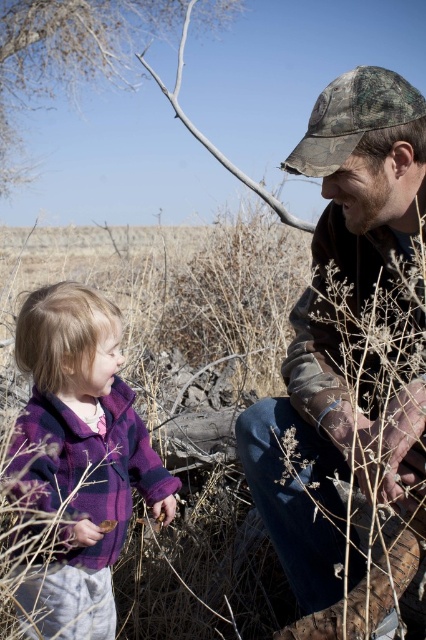
Question: Does camouflage fabric hat at upper right have a greater width compared to purple fleece jacket at left?

Choices:
 (A) yes
 (B) no

Answer: (A)

Question: Is camouflage fabric hat at upper right smaller than purple fleece jacket at left?

Choices:
 (A) no
 (B) yes

Answer: (A)

Question: Which point appears farthest from the camera in this image?

Choices:
 (A) (43, 477)
 (B) (262, 465)

Answer: (B)

Question: Which point appears closest to the camera in this image?

Choices:
 (A) (331, 472)
 (B) (28, 580)

Answer: (B)

Question: Does camouflage fabric hat at upper right have a smaller size compared to purple fleece jacket at left?

Choices:
 (A) yes
 (B) no

Answer: (B)

Question: Among these points, which one is nearest to the camera?

Choices:
 (A) (58, 392)
 (B) (319, 308)

Answer: (B)